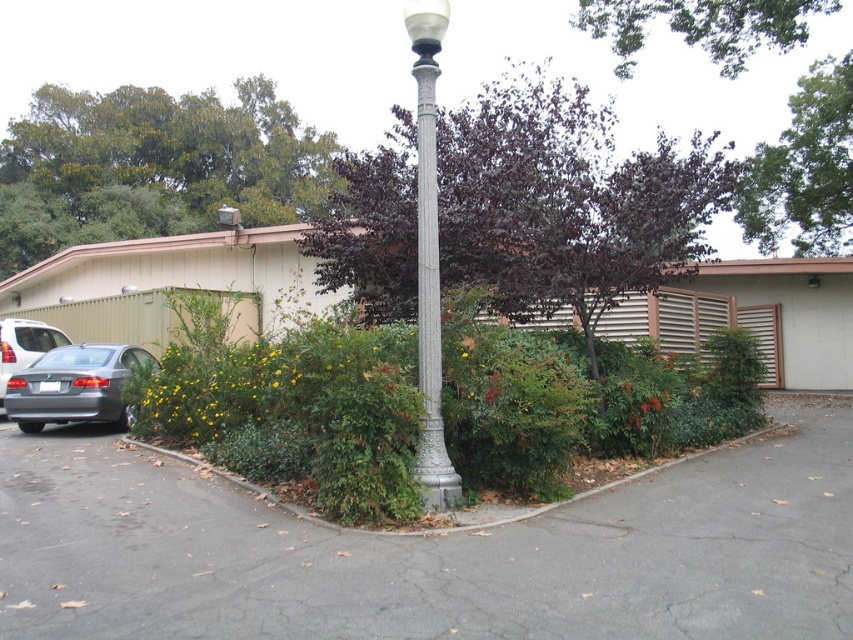
Question: Is purple leafy tree at upper center positioned at the back of dark purple leafy tree at upper center?

Choices:
 (A) no
 (B) yes

Answer: (A)

Question: Which object appears closest to the camera in this image?

Choices:
 (A) dark green leafy tree at upper center
 (B) dark purple leafy tree at upper center
 (C) silver textured street light at center
 (D) green leafy tree at upper left

Answer: (C)

Question: Is dark purple leafy tree at upper center below dark green leafy tree at upper center?

Choices:
 (A) yes
 (B) no

Answer: (A)

Question: Which point is closer to the camera?

Choices:
 (A) (825, 250)
 (B) (431, 184)
 (C) (674, 10)

Answer: (B)

Question: Is gray asphalt driveway at center smaller than purple-leaved tree at center?

Choices:
 (A) no
 (B) yes

Answer: (B)

Question: Which point is closer to the camera?

Choices:
 (A) silver textured street light at center
 (B) satin silver car at left
 (C) green leafy tree at upper left
 (D) satin gray sedan at lower left

Answer: (A)